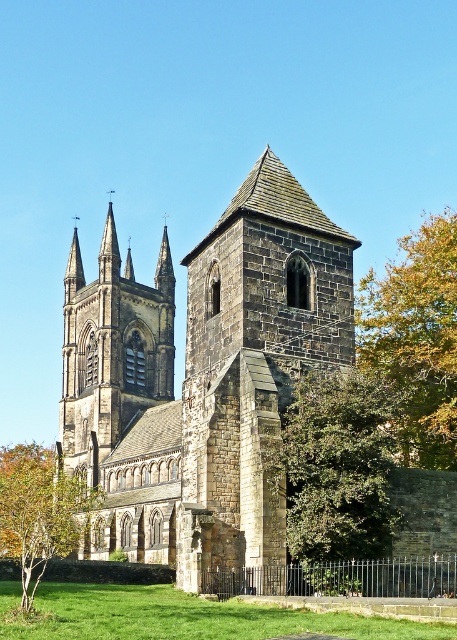
You are standing at a point 395.11 feet away from the church. You want to take a photo of the central spire of the historic stone church. Is the central spire visible in your camera frame if you are positioned at point point (138, 310)?

The point (138, 310) is 395.11 feet away from the camera. Since the central spire is part of the church structure, it should be visible in the camera frame when positioned at this point.

You are standing in front of the church and want to plant a new tree. The tree you have is 5 meters wide. Which existing tree, the green leafy tree at center or the green leafy tree at right, would require more space if you want to plant your new tree next to it?

The green leafy tree at right has a greater width than the green leafy tree at center, so planting the new tree next to the green leafy tree at right would require more space.